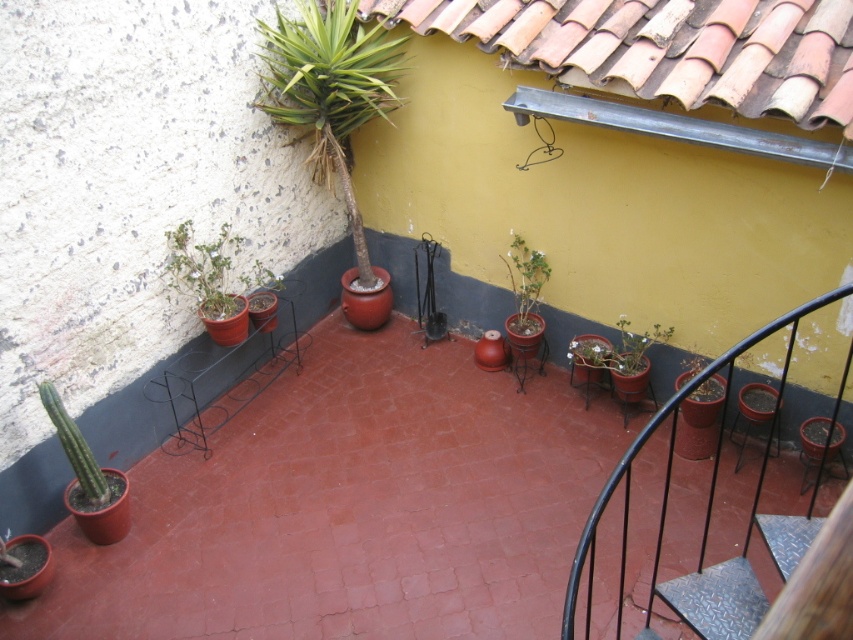
Question: Estimate the real-world distances between objects in this image. Which object is farther from the black metal railing at upper right?

Choices:
 (A) green matte plant at lower right
 (B) metallic diamond plate at lower right

Answer: (A)

Question: Does black metal railing at upper right appear under green matte plant at lower right?

Choices:
 (A) no
 (B) yes

Answer: (B)

Question: Is black metal railing at upper right thinner than green matte plant at center?

Choices:
 (A) no
 (B) yes

Answer: (A)

Question: Among these points, which one is farthest from the camera?

Choices:
 (A) (271, 371)
 (B) (302, 40)

Answer: (A)

Question: Is black metal railing at upper right below green matte plant at lower right?

Choices:
 (A) yes
 (B) no

Answer: (A)

Question: Which of these objects is positioned closest to the black metal/iron at lower center?

Choices:
 (A) metallic diamond plate at lower right
 (B) green matte plant at center
 (C) green matte plant at lower right
 (D) green matte plant at left

Answer: (D)